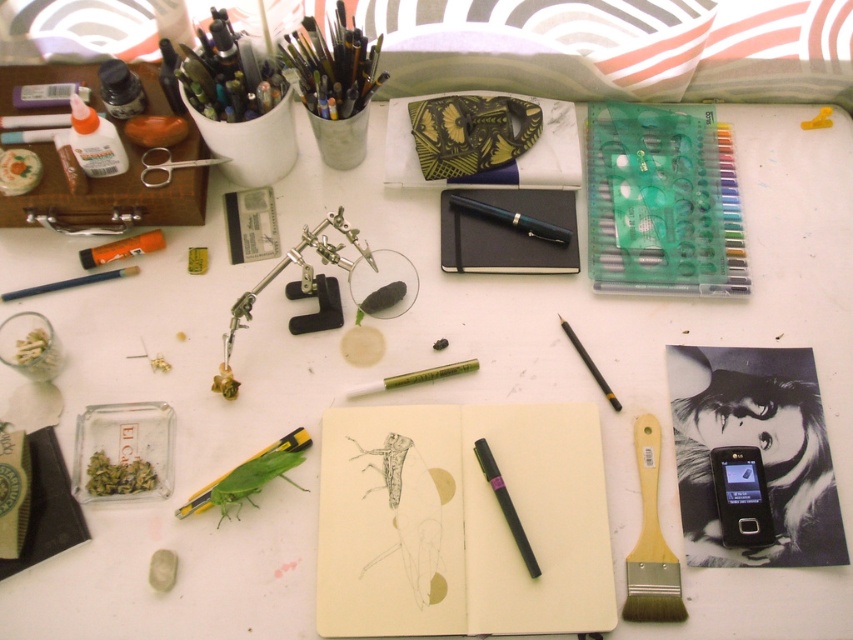
Does black matte notepad at center have a greater height compared to matte orange eraser at upper left?

Indeed, black matte notepad at center has a greater height compared to matte orange eraser at upper left.

Does black matte notepad at center appear on the right side of matte orange eraser at upper left?

Indeed, black matte notepad at center is positioned on the right side of matte orange eraser at upper left.

Measure the distance between black matte notepad at center and camera.

black matte notepad at center and camera are 3.62 feet apart.

The height and width of the screenshot is (640, 853). In order to click on black matte notepad at center in this screenshot , I will do 508,232.

Is black matte notepad at center positioned at the back of black plastic phone at lower right?

That is True.

Is point (467, 237) closer to viewer compared to point (747, 476)?

No, (467, 237) is behind (747, 476).

The image size is (853, 640). Identify the location of black matte notepad at center. (508, 232).

Is point (512, 497) farther from camera compared to point (96, 275)?

No, it is in front of (96, 275).

The height and width of the screenshot is (640, 853). Find the location of `white paper notebook at center`. white paper notebook at center is located at coordinates (461, 522).

This screenshot has width=853, height=640. Find the location of `white paper notebook at center`. white paper notebook at center is located at coordinates (461, 522).